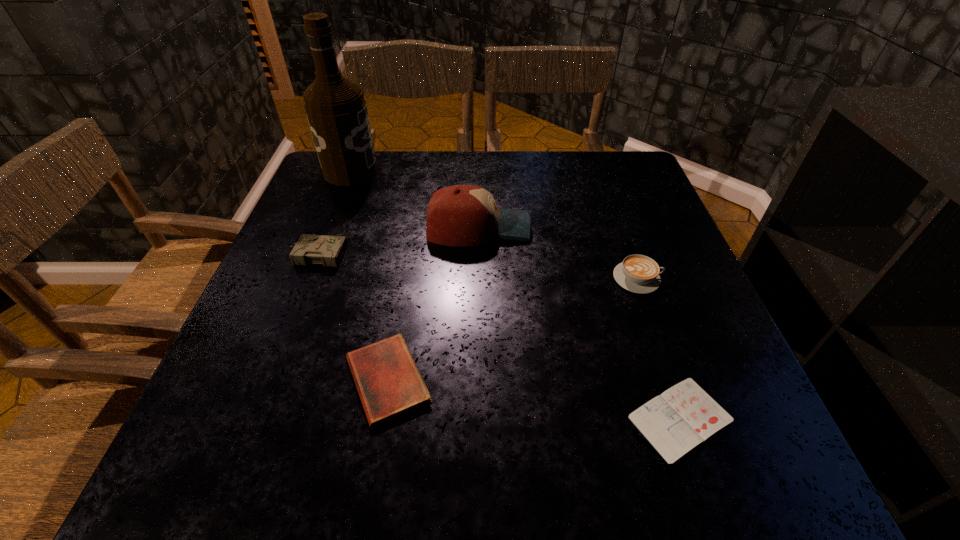
Locate an element on the screen. The height and width of the screenshot is (540, 960). free area in between the second diary from left to right and the baseball cap is located at coordinates (433, 303).

At what (x,y) coordinates should I click in order to perform the action: click on free spot between the tallest diary and the second diary from left to right. Please return your answer as a coordinate pair (x, y). This screenshot has width=960, height=540. Looking at the image, I should click on (352, 317).

Find the location of a particular element. This screenshot has width=960, height=540. free point between the farthest diary and the farthest object is located at coordinates (333, 213).

Where is `vacant space that is in between the cappuccino and the second diary from right to left`? The image size is (960, 540). vacant space that is in between the cappuccino and the second diary from right to left is located at coordinates (513, 329).

This screenshot has height=540, width=960. I want to click on vacant space that's between the baseball cap and the alcohol, so click(x=415, y=200).

Identify the location of vacant space that's between the tallest object and the farthest diary. (333, 213).

Where is `blank region between the shortest object and the cappuccino`? The width and height of the screenshot is (960, 540). blank region between the shortest object and the cappuccino is located at coordinates (660, 348).

Where is `free spot between the second tallest object and the cappuccino`? The width and height of the screenshot is (960, 540). free spot between the second tallest object and the cappuccino is located at coordinates (558, 253).

Find the location of a particular element. The height and width of the screenshot is (540, 960). empty space between the rightmost diary and the cappuccino is located at coordinates pos(660,348).

Identify which object is located as the second nearest to the tallest diary. Please provide its 2D coordinates. Your answer should be formatted as a tuple, i.e. [(x, y)], where the tuple contains the x and y coordinates of a point satisfying the conditions above.

[(389, 383)]